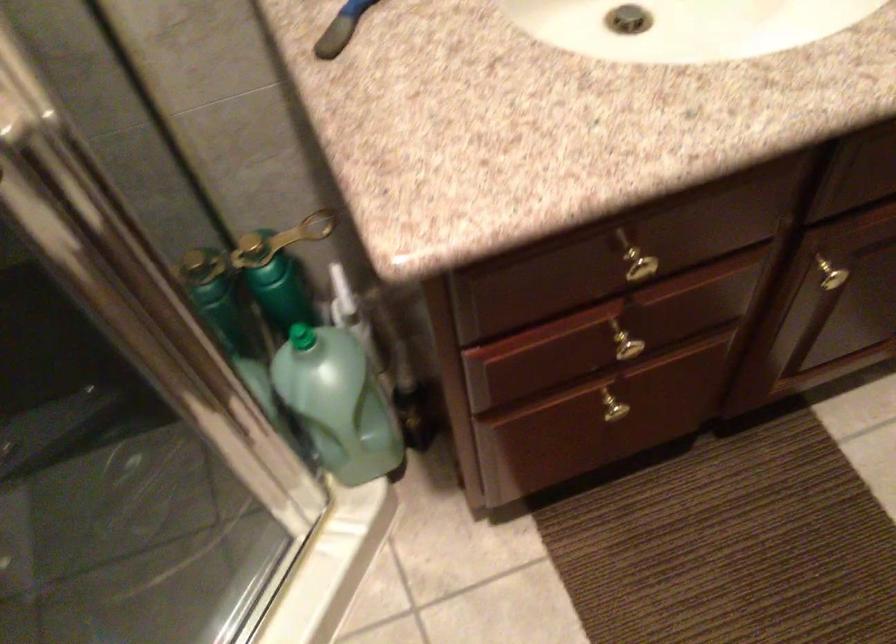
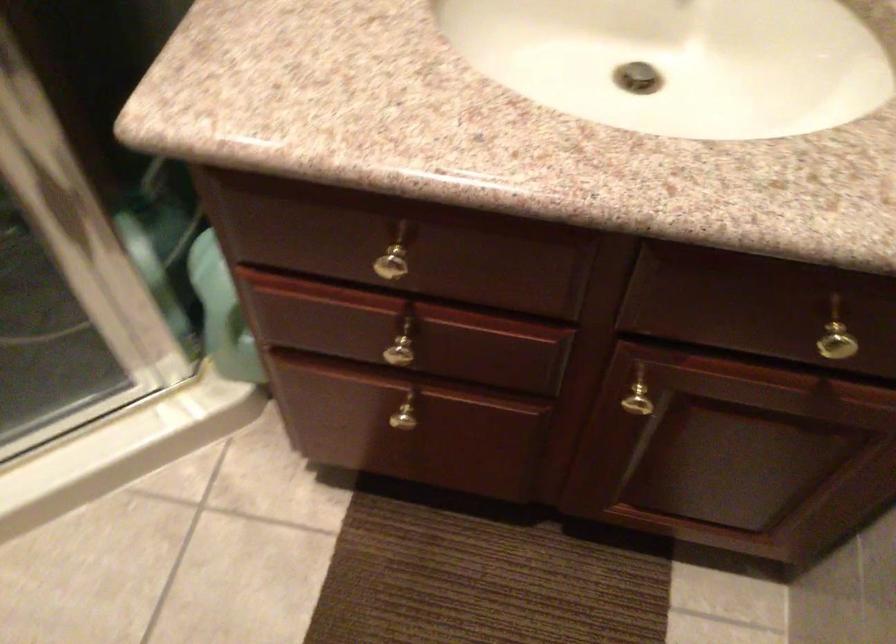
Question: I am providing you with two images of the same scene from different viewpoints. After the viewpoint changes to image2, which objects are now occluded?

Choices:
 (A) gold cabinet knob
 (B) yellow board game box
 (C) green bottle cap
 (D) gold drawer knob

Answer: (C)